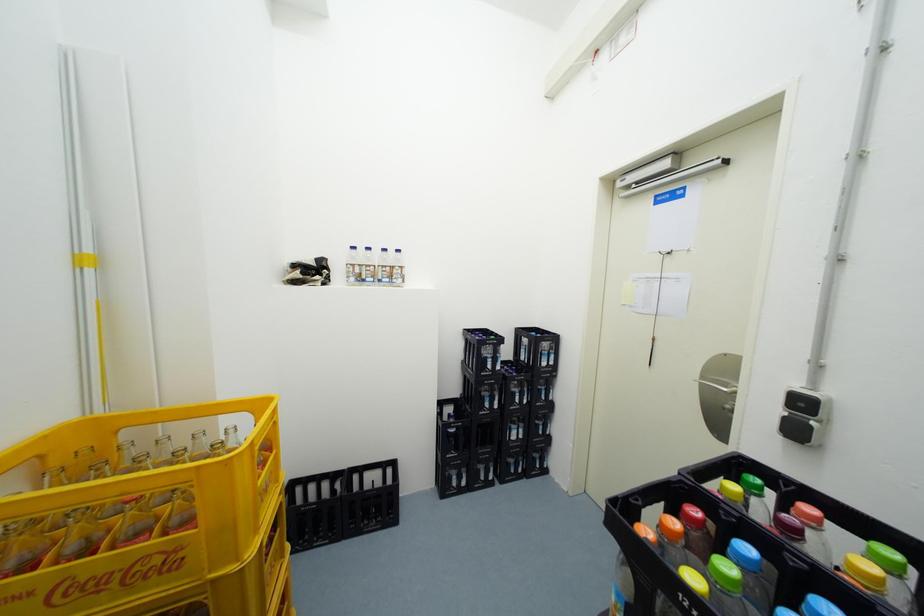
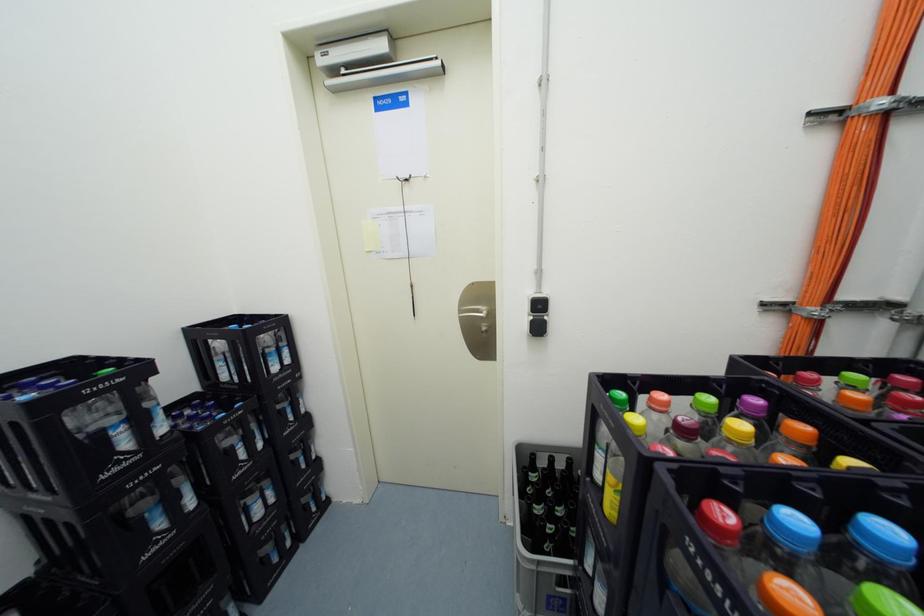
Question: The first image is from the beginning of the video and the second image is from the end. How did the camera likely rotate when shooting the video?

Choices:
 (A) Left
 (B) Right
 (C) Up
 (D) Down

Answer: (B)